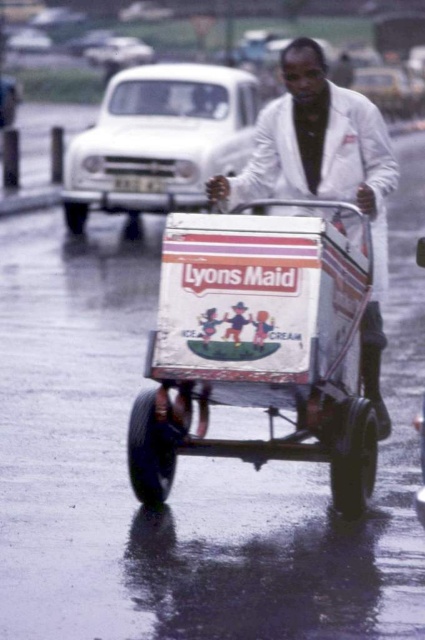
Question: Where is metallic ice cream wagon at center located in relation to white matte jacket at center in the image?

Choices:
 (A) right
 (B) left

Answer: (B)

Question: Which point is closer to the camera taking this photo?

Choices:
 (A) (138, 416)
 (B) (351, 115)

Answer: (A)

Question: Does metallic ice cream wagon at center have a lesser width compared to white matte jacket at center?

Choices:
 (A) no
 (B) yes

Answer: (A)

Question: Which point is closer to the camera taking this photo?

Choices:
 (A) (337, 248)
 (B) (337, 86)

Answer: (A)

Question: Is metallic ice cream wagon at center wider than white matte jacket at center?

Choices:
 (A) yes
 (B) no

Answer: (A)

Question: Which point is farther to the camera?

Choices:
 (A) (343, 316)
 (B) (356, 99)

Answer: (B)